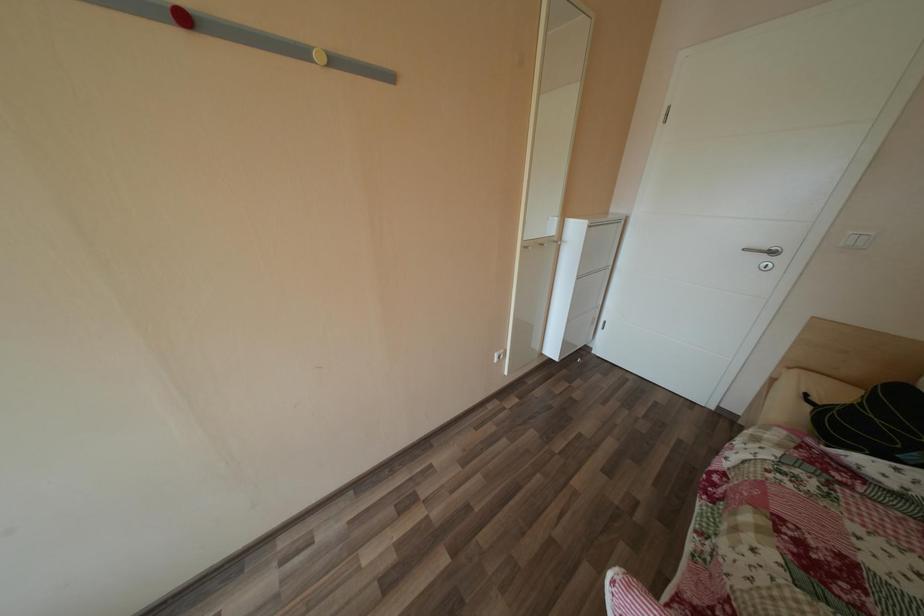
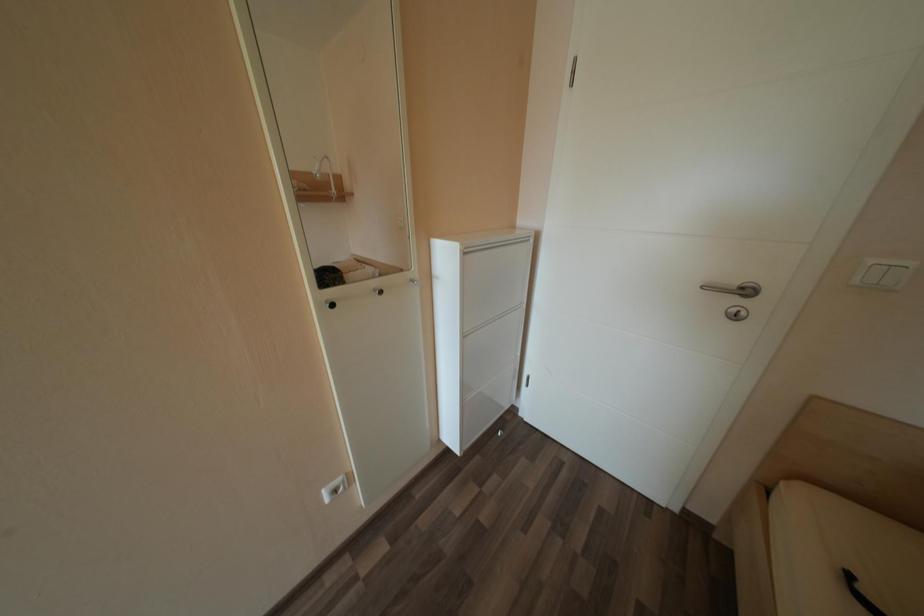
From the picture: The images are taken continuously from a first-person perspective. In which direction are you moving?

The cameraman moved toward right, forward.